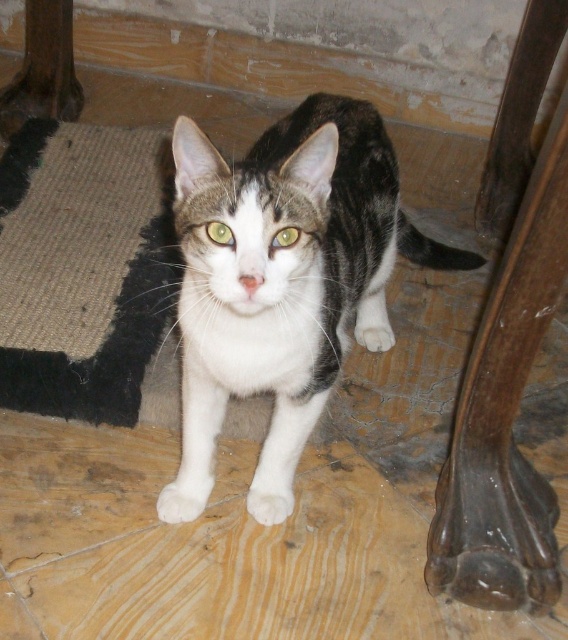
Question: From the image, what is the correct spatial relationship of white fur cat at center in relation to sisal carpet at lower left?

Choices:
 (A) below
 (B) above

Answer: (A)

Question: Can you confirm if white fur cat at center is positioned below sisal carpet at lower left?

Choices:
 (A) yes
 (B) no

Answer: (A)

Question: Is white fur cat at center bigger than sisal carpet at lower left?

Choices:
 (A) yes
 (B) no

Answer: (A)

Question: Which point appears closest to the camera in this image?

Choices:
 (A) (360, 234)
 (B) (31, 346)

Answer: (A)

Question: Which point is closer to the camera?

Choices:
 (A) (64, 388)
 (B) (194, 234)

Answer: (B)